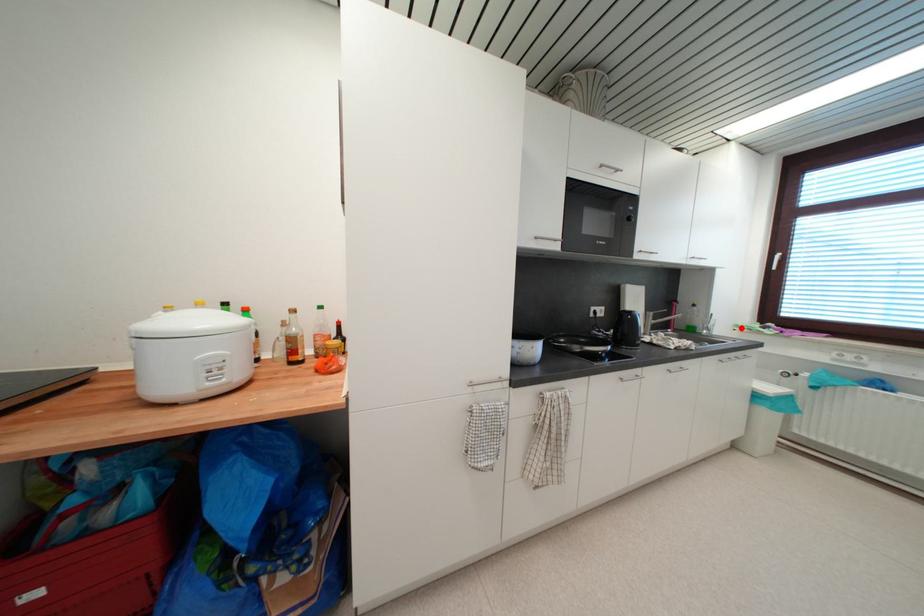
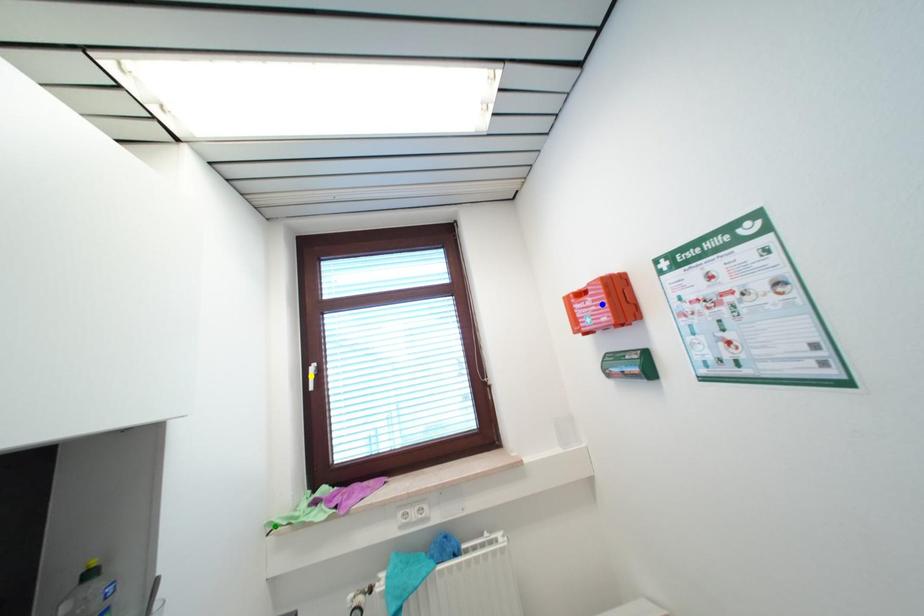
Question: I am providing you with two images of the same scene from different viewpoints. A red point is marked on the first image. You are given multiple points on the second image. Can you choose the point in image 2 that corresponds to the point in image 1?

Choices:
 (A) yellow point
 (B) green point
 (C) blue point

Answer: (B)